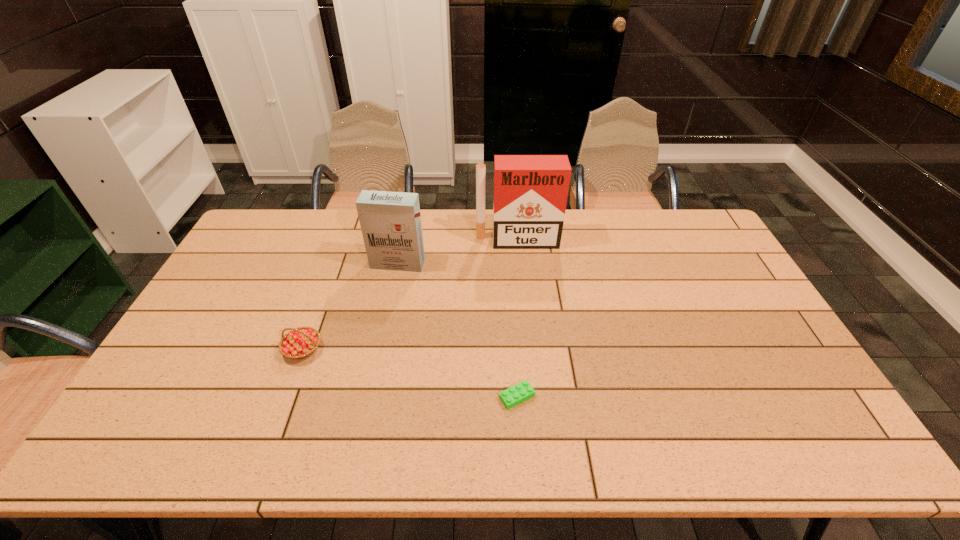
In order to click on object that is the third closest one to the shortest object in this screenshot , I will do pos(530,195).

At what (x,y) coordinates should I click in order to perform the action: click on vacant space that satisfies the following two spatial constraints: 1. on the front side of the shortest object; 2. on the right side of the left cigarette case. Please return your answer as a coordinate pair (x, y). The image size is (960, 540). Looking at the image, I should click on (371, 397).